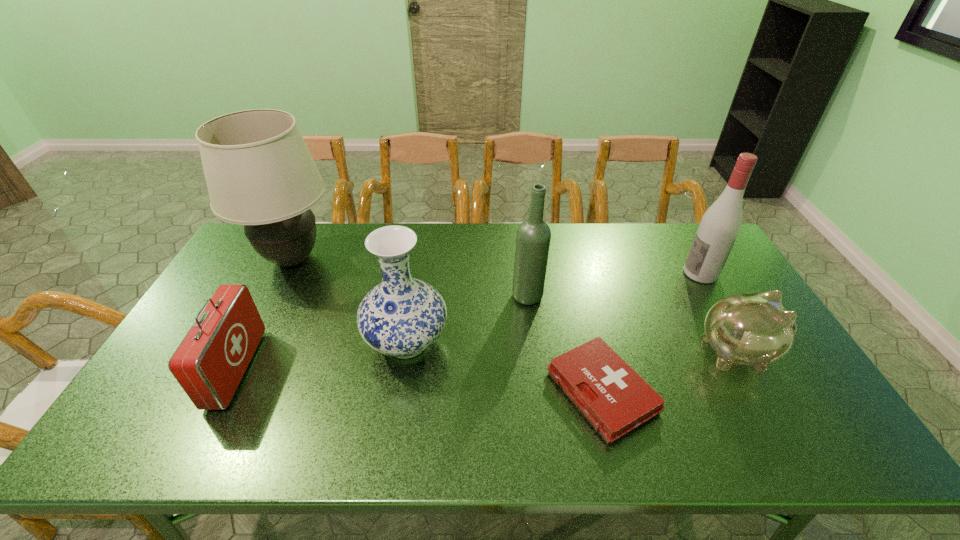
Where is `lampshade`? lampshade is located at coordinates (259, 171).

The height and width of the screenshot is (540, 960). Identify the location of alcohol. 720,225.

Where is `wine bottle`? The height and width of the screenshot is (540, 960). wine bottle is located at coordinates (533, 237).

Image resolution: width=960 pixels, height=540 pixels. I want to click on vase, so click(401, 317).

Find the location of a particular element. This screenshot has height=540, width=960. the third shortest object is located at coordinates (209, 363).

This screenshot has width=960, height=540. I want to click on the left first-aid kit, so click(209, 363).

Locate an element on the screen. This screenshot has width=960, height=540. the second shortest object is located at coordinates (754, 329).

You are a GUI agent. You are given a task and a screenshot of the screen. Output one action in this format:
    pyautogui.click(x=<x>, y=<y>)
    Task: Click on the shorter first-aid kit
    The width and height of the screenshot is (960, 540).
    Given the screenshot: What is the action you would take?
    pyautogui.click(x=615, y=399)

The height and width of the screenshot is (540, 960). In order to click on the shortest object in this screenshot , I will do `click(615, 399)`.

You are a GUI agent. You are given a task and a screenshot of the screen. Output one action in this format:
    pyautogui.click(x=<x>, y=<y>)
    Task: Click on the free space located on the right of the lampshade
    This screenshot has height=540, width=960.
    Given the screenshot: What is the action you would take?
    tap(414, 259)